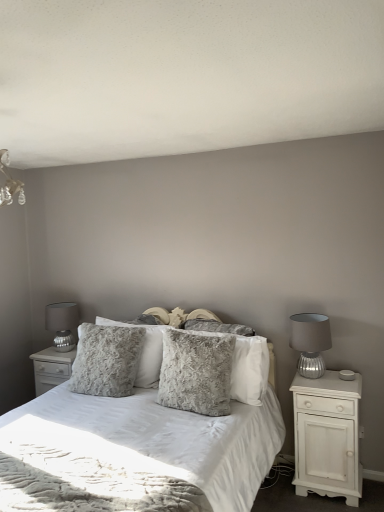
Question: Does fluffy gray pillow at center, which is the 3th pillow from front to back, appear on the left side of white textured nightstand at center, which is the 1th nightstand from left to right?

Choices:
 (A) yes
 (B) no

Answer: (B)

Question: Are fluffy gray pillow at center, which is the 3th pillow from front to back, and white textured nightstand at center, which is the 2th nightstand in right-to-left order, located far from each other?

Choices:
 (A) yes
 (B) no

Answer: (B)

Question: Does fluffy gray pillow at center, the 1th pillow when ordered from back to front, come in front of white textured nightstand at center, which is the 1th nightstand from left to right?

Choices:
 (A) no
 (B) yes

Answer: (B)

Question: Is fluffy gray pillow at center, which is the 3th pillow from front to back, oriented away from white textured nightstand at center, which is the 2th nightstand in right-to-left order?

Choices:
 (A) yes
 (B) no

Answer: (B)

Question: Can we say fluffy gray pillow at center, the 1th pillow when ordered from back to front, lies outside white textured nightstand at center, the 1th nightstand viewed from the back?

Choices:
 (A) no
 (B) yes

Answer: (B)

Question: Considering the relative sizes of fluffy gray pillow at center, which is the 3th pillow from front to back, and white textured nightstand at center, which is the 1th nightstand from left to right, in the image provided, is fluffy gray pillow at center, which is the 3th pillow from front to back, taller than white textured nightstand at center, which is the 1th nightstand from left to right,?

Choices:
 (A) no
 (B) yes

Answer: (B)

Question: Does white wood nightstand at right, arranged as the 2th nightstand when viewed from the left, lie in front of white textured nightstand at center, which is the 2th nightstand in right-to-left order?

Choices:
 (A) yes
 (B) no

Answer: (A)

Question: Would you say white wood nightstand at right, arranged as the 2th nightstand when viewed from the left, is outside white textured nightstand at center, which is the 2th nightstand in right-to-left order?

Choices:
 (A) no
 (B) yes

Answer: (B)

Question: Considering the relative sizes of white wood nightstand at right, marked as the 1th nightstand in a right-to-left arrangement, and white textured nightstand at center, the 1th nightstand viewed from the back, in the image provided, is white wood nightstand at right, marked as the 1th nightstand in a right-to-left arrangement, smaller than white textured nightstand at center, the 1th nightstand viewed from the back,?

Choices:
 (A) no
 (B) yes

Answer: (A)

Question: From a real-world perspective, is white wood nightstand at right, arranged as the 2th nightstand when viewed from the left, below white textured nightstand at center, the 1th nightstand viewed from the back?

Choices:
 (A) no
 (B) yes

Answer: (B)

Question: Can you confirm if white wood nightstand at right, arranged as the 2th nightstand when viewed from the left, is positioned to the left of white textured nightstand at center, which ranks as the 2th nightstand in front-to-back order?

Choices:
 (A) yes
 (B) no

Answer: (B)

Question: From the image's perspective, would you say white wood nightstand at right, marked as the 1th nightstand in a right-to-left arrangement, is positioned over white textured nightstand at center, which is the 1th nightstand from left to right?

Choices:
 (A) no
 (B) yes

Answer: (A)

Question: Considering the relative sizes of white wood nightstand at right, arranged as the 2th nightstand when viewed from the left, and fuzzy fabric bed at center in the image provided, is white wood nightstand at right, arranged as the 2th nightstand when viewed from the left, thinner than fuzzy fabric bed at center?

Choices:
 (A) no
 (B) yes

Answer: (B)